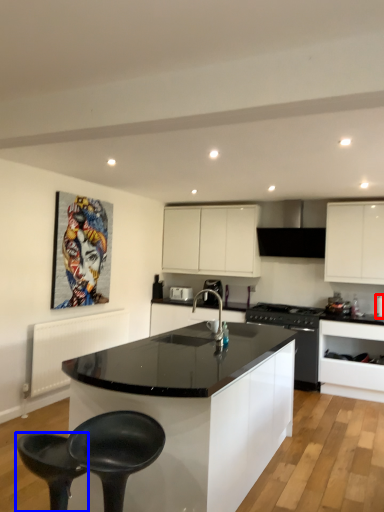
Question: Which object is closer to the camera taking this photo, appliance (highlighted by a red box) or bar stool (highlighted by a blue box)?

Choices:
 (A) appliance
 (B) bar stool

Answer: (B)